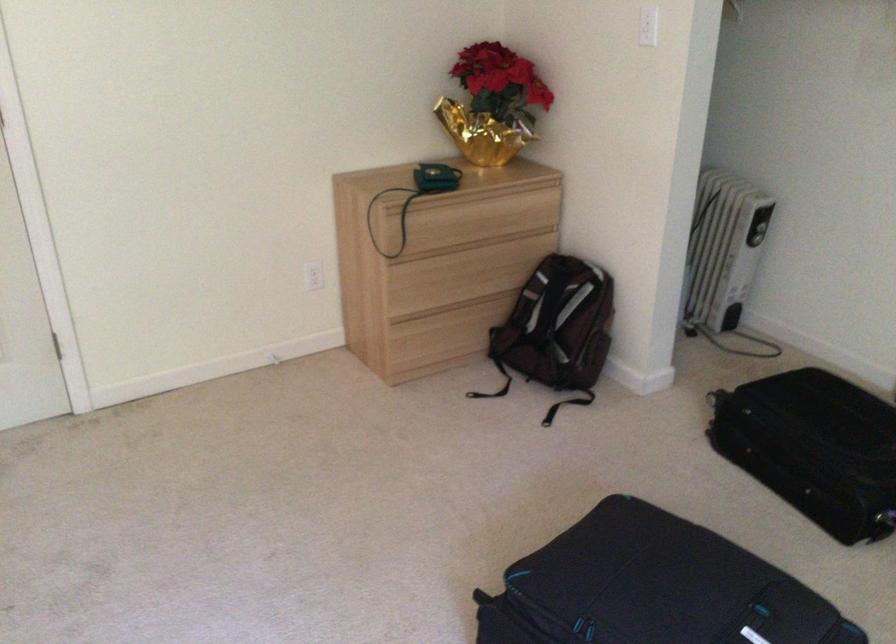
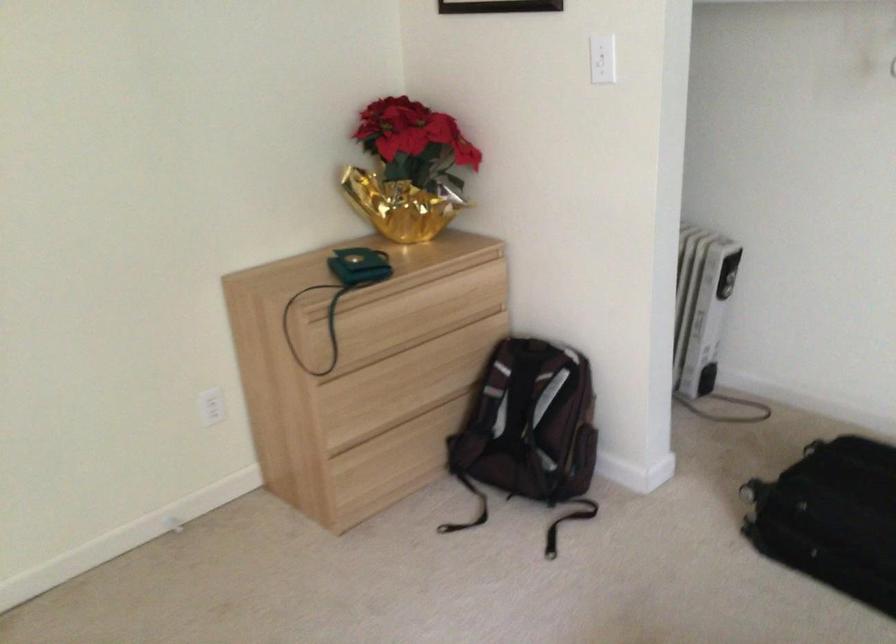
The images are taken continuously from a first-person perspective. In which direction are you moving?

The cameraman moved toward left, forward.